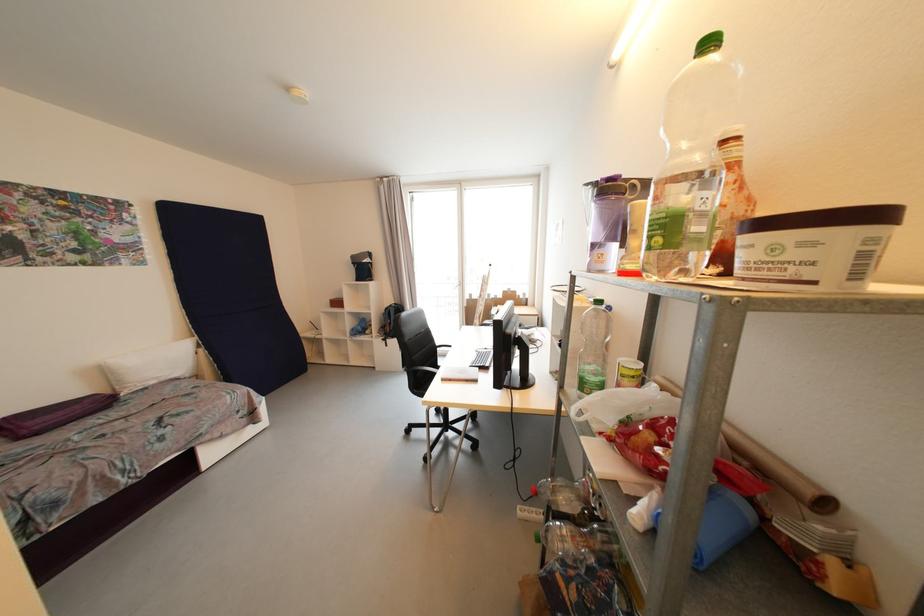
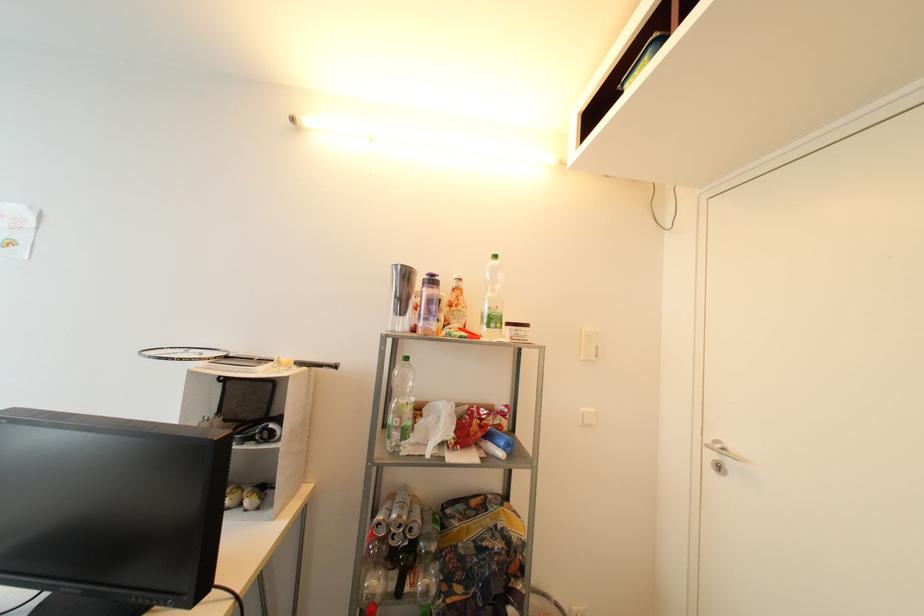
Question: The camera is either moving clockwise (left) or counter-clockwise (right) around the object. The first image is from the beginning of the video and the second image is from the end. Is the camera moving left or right when shooting the video?

Choices:
 (A) Left
 (B) Right

Answer: (A)